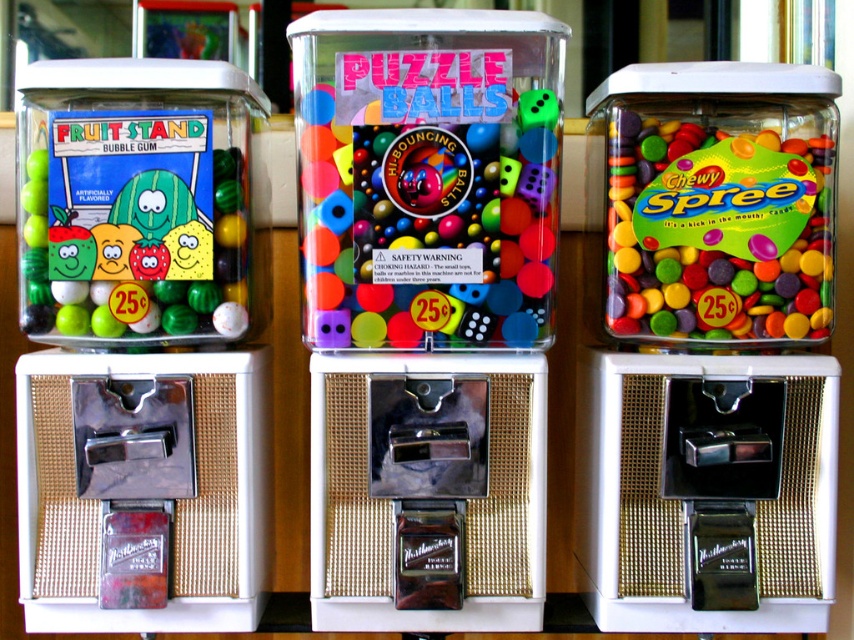
You are standing in front of the three gumball machines and want to reach both the matte plastic jar at left and the matte plastic chewy spree at right. Which machine should you approach first if you want to minimize the distance walked?

You should approach the matte plastic jar at left first because it is closer to your starting position than the matte plastic chewy spree at right, as it is positioned to the left of the chewy spree machine.